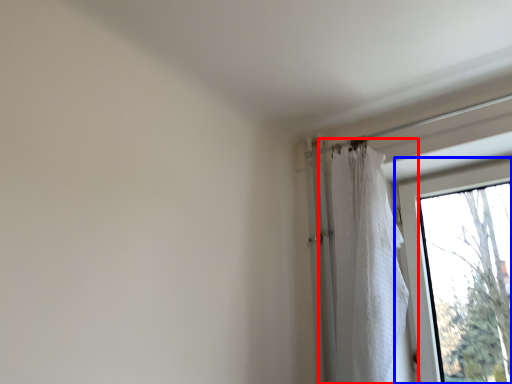
Question: Which object appears farthest to the camera in this image, curtain (highlighted by a red box) or window (highlighted by a blue box)?

Choices:
 (A) curtain
 (B) window

Answer: (B)